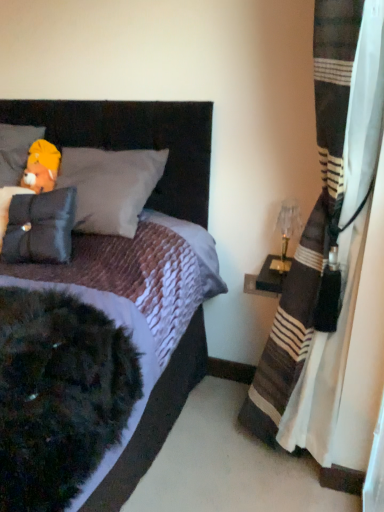
Question: Is velvet dark brown bed at center bigger or smaller than translucent glass table lamp at right?

Choices:
 (A) big
 (B) small

Answer: (A)

Question: From the image's perspective, is velvet dark brown bed at center located above or below translucent glass table lamp at right?

Choices:
 (A) above
 (B) below

Answer: (B)

Question: Which is nearer to the fluffy yellow bear at upper left?

Choices:
 (A) velvet dark brown bed at center
 (B) translucent glass table lamp at right
 (C) striped fabric curtain at right
 (D) soft yellow plush at upper left, the 2th pillow when ordered from bottom to top
 (E) matte black headboard at upper left

Answer: (D)

Question: Considering the real-world distances, which object is closest to the soft yellow plush at upper left, the 2th pillow when ordered from bottom to top?

Choices:
 (A) fluffy yellow bear at upper left
 (B) translucent glass table lamp at right
 (C) velvet dark brown bed at center
 (D) matte black pillow at left, arranged as the 2th pillow when viewed from the top
 (E) striped fabric curtain at right

Answer: (A)